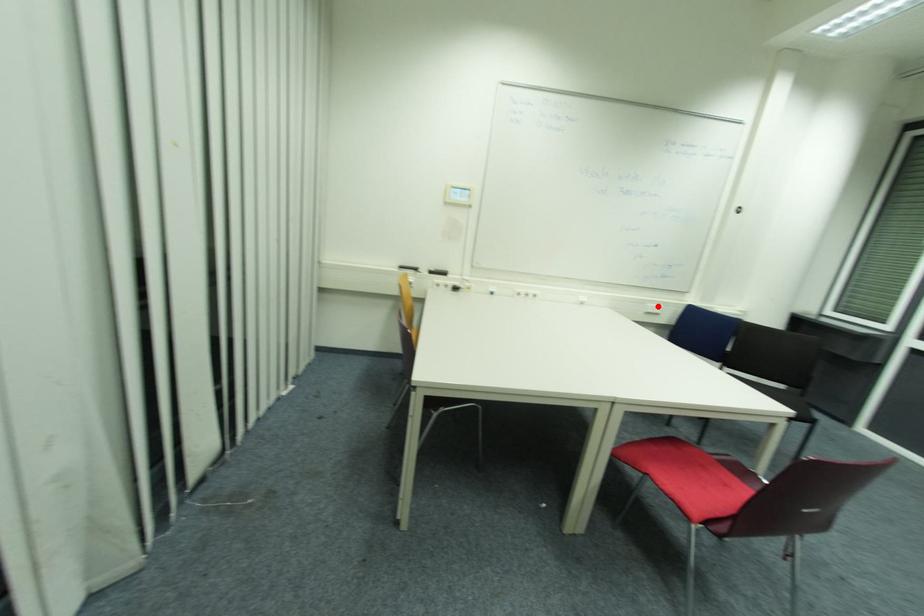
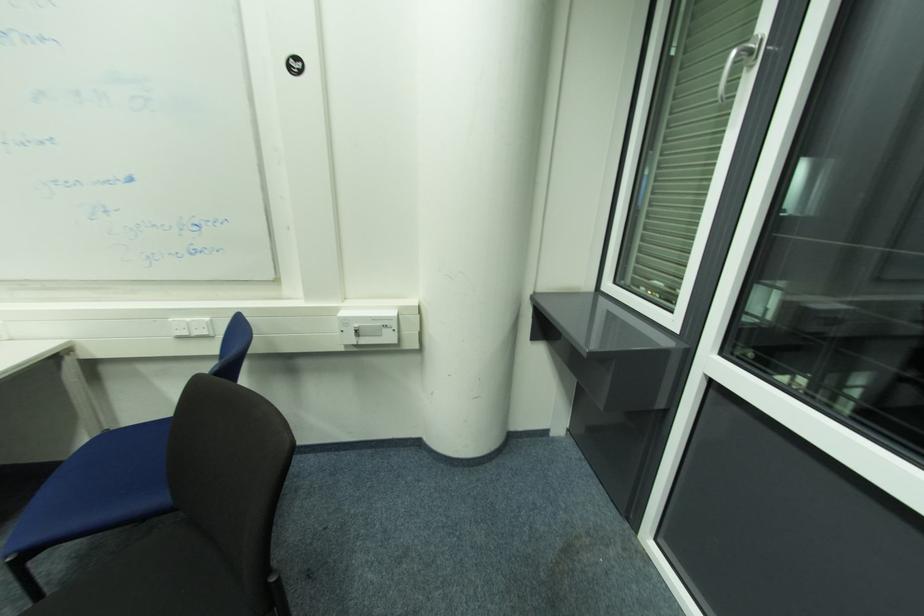
In the second image, find the point that corresponds to the highlighted location in the first image.

(191, 320)